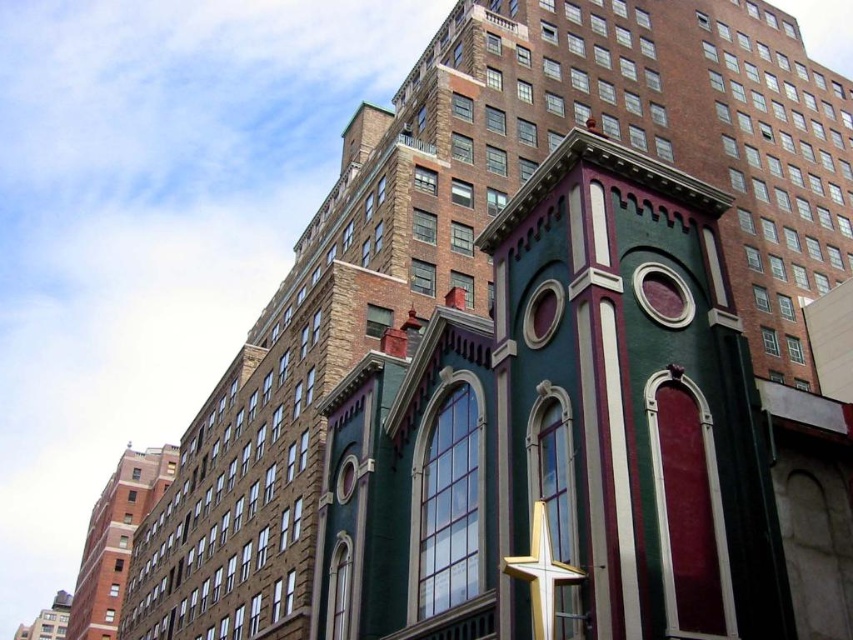
Between green painted brick church at lower left and gold metallic star at center, which one is positioned higher?

gold metallic star at center is above.

Is green painted brick church at lower left to the right of gold metallic star at center from the viewer's perspective?

No, green painted brick church at lower left is not to the right of gold metallic star at center.

Does point (131, 540) come behind point (544, 616)?

Yes, point (131, 540) is behind point (544, 616).

This screenshot has width=853, height=640. I want to click on green painted brick church at lower left, so click(x=115, y=538).

Can you confirm if gold metallic star at center is taller than green matte church at lower left?

No.

Does point (538, 518) come closer to viewer compared to point (55, 618)?

Yes, point (538, 518) is closer to viewer.

Locate an element on the screen. gold metallic star at center is located at coordinates (541, 572).

Is green painted brick church at lower left bigger than green matte church at lower left?

Yes.

Which is below, green painted brick church at lower left or green matte church at lower left?

green matte church at lower left

Who is more forward, (113, 552) or (28, 632)?

Point (113, 552)

Locate an element on the screen. green painted brick church at lower left is located at coordinates (115, 538).